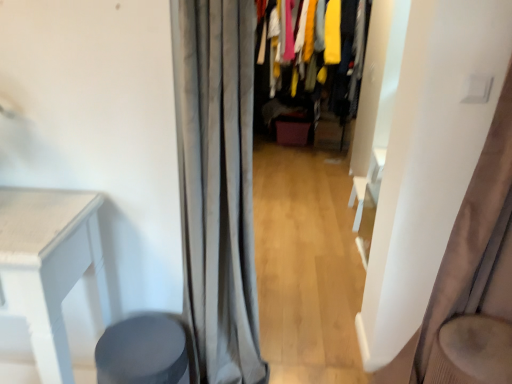
Where is `velvet fabric clothes at center`? The image size is (512, 384). velvet fabric clothes at center is located at coordinates (279, 82).

Measure the distance between satin beige curtain at right, positioned as the 1th curtain in right-to-left order, and camera.

satin beige curtain at right, positioned as the 1th curtain in right-to-left order, and camera are 4.15 feet apart from each other.

I want to click on matte gray stool at lower left, so click(x=143, y=351).

What are the coordinates of `gray fabric curtain at center, which is the first curtain from left to right` in the screenshot? It's located at (218, 190).

Locate an element on the screen. velvet fabric clothes at center is located at coordinates (279, 82).

From the image's perspective, which is below, matte gray stool at lower left or velvet beige swivel chair at right?

velvet beige swivel chair at right.

Considering the sizes of objects matte gray stool at lower left and velvet beige swivel chair at right in the image provided, who is thinner, matte gray stool at lower left or velvet beige swivel chair at right?

With smaller width is matte gray stool at lower left.

Which of these two, matte gray stool at lower left or velvet beige swivel chair at right, stands taller?

With more height is velvet beige swivel chair at right.

Is matte gray stool at lower left not within velvet beige swivel chair at right?

Indeed, matte gray stool at lower left is completely outside velvet beige swivel chair at right.

Based on the photo, how far apart are velvet fabric clothes at center and satin beige curtain at right, positioned as the 1th curtain in right-to-left order?

velvet fabric clothes at center is 2.83 meters away from satin beige curtain at right, positioned as the 1th curtain in right-to-left order.

Considering the sizes of objects velvet fabric clothes at center and satin beige curtain at right, arranged as the 2th curtain when viewed from the left, in the image provided, who is smaller, velvet fabric clothes at center or satin beige curtain at right, arranged as the 2th curtain when viewed from the left,?

Smaller between the two is satin beige curtain at right, arranged as the 2th curtain when viewed from the left.

Does point (255, 73) lie behind point (500, 366)?

Yes, point (255, 73) is farther from viewer.

Could satin beige curtain at right, arranged as the 2th curtain when viewed from the left, be considered to be inside velvet fabric clothes at center?

That's incorrect, satin beige curtain at right, arranged as the 2th curtain when viewed from the left, is not inside velvet fabric clothes at center.

Is matte gray stool at lower left taller than satin beige curtain at right, arranged as the 2th curtain when viewed from the left?

In fact, matte gray stool at lower left may be shorter than satin beige curtain at right, arranged as the 2th curtain when viewed from the left.

Based on the photo, is matte gray stool at lower left inside the boundaries of satin beige curtain at right, arranged as the 2th curtain when viewed from the left, or outside?

matte gray stool at lower left is located beyond the bounds of satin beige curtain at right, arranged as the 2th curtain when viewed from the left.

Considering the relative sizes of matte gray stool at lower left and satin beige curtain at right, arranged as the 2th curtain when viewed from the left, in the image provided, is matte gray stool at lower left thinner than satin beige curtain at right, arranged as the 2th curtain when viewed from the left,?

No.

Between matte gray stool at lower left and satin beige curtain at right, arranged as the 2th curtain when viewed from the left, which one has larger size?

satin beige curtain at right, arranged as the 2th curtain when viewed from the left.

Which object is closer to the camera, satin beige curtain at right, arranged as the 2th curtain when viewed from the left, or velvet beige swivel chair at right?

satin beige curtain at right, arranged as the 2th curtain when viewed from the left, is closer to the camera.

Is satin beige curtain at right, positioned as the 1th curtain in right-to-left order, turned away from velvet beige swivel chair at right?

Yes, velvet beige swivel chair at right is at the back of satin beige curtain at right, positioned as the 1th curtain in right-to-left order.

From the picture: Considering the relative sizes of satin beige curtain at right, arranged as the 2th curtain when viewed from the left, and velvet beige swivel chair at right in the image provided, is satin beige curtain at right, arranged as the 2th curtain when viewed from the left, smaller than velvet beige swivel chair at right?

No.

Locate an element on the screen. This screenshot has height=384, width=512. swivel chair that is on the right side of satin beige curtain at right, arranged as the 2th curtain when viewed from the left is located at coordinates (471, 351).

Based on the photo, from the image's perspective, between gray fabric curtain at center, which is the first curtain from left to right, and velvet beige swivel chair at right, which one is located above?

gray fabric curtain at center, which is the first curtain from left to right.

From the velvet beige swivel chair at right, count the 2nd curtain to the left and point to it. Please provide its 2D coordinates.

[(218, 190)]

From the picture: Could you tell me if gray fabric curtain at center, which is the first curtain from left to right, is turned towards velvet beige swivel chair at right?

No.

Considering the positions of objects gray fabric curtain at center, which is the first curtain from left to right, and velvet beige swivel chair at right in the image provided, who is more to the right, gray fabric curtain at center, which is the first curtain from left to right, or velvet beige swivel chair at right?

From the viewer's perspective, velvet beige swivel chair at right appears more on the right side.

How different are the orientations of velvet beige swivel chair at right and matte gray stool at lower left in degrees?

The facing directions of velvet beige swivel chair at right and matte gray stool at lower left are 9.99 degrees apart.

From the image's perspective, is velvet beige swivel chair at right above or below matte gray stool at lower left?

velvet beige swivel chair at right is below matte gray stool at lower left.

Is velvet beige swivel chair at right positioned beyond the bounds of matte gray stool at lower left?

Yes.

Based on the photo, is velvet fabric clothes at center placed right next to matte gray stool at lower left?

No, velvet fabric clothes at center is not beside matte gray stool at lower left.

How many degrees apart are the facing directions of velvet fabric clothes at center and matte gray stool at lower left?

The facing directions of velvet fabric clothes at center and matte gray stool at lower left are 0.368 degrees apart.

Find the location of a particular element. This screenshot has width=512, height=384. music stool located in front of the velvet fabric clothes at center is located at coordinates (143, 351).

Based on the photo, in the image, is velvet fabric clothes at center positioned in front of or behind matte gray stool at lower left?

In the image, velvet fabric clothes at center appears behind matte gray stool at lower left.

What are the coordinates of `swivel chair on the right side of matte gray stool at lower left` in the screenshot? It's located at (471, 351).

Find the location of a particular element. The image size is (512, 384). curtain that is the 2nd object located in front of the velvet fabric clothes at center is located at coordinates click(471, 279).

When comparing their distances from satin beige curtain at right, arranged as the 2th curtain when viewed from the left, does matte gray stool at lower left or velvet beige swivel chair at right seem closer?

velvet beige swivel chair at right lies closer to satin beige curtain at right, arranged as the 2th curtain when viewed from the left, than the other object.

Looking at the image, which one is located closer to matte gray stool at lower left, satin beige curtain at right, arranged as the 2th curtain when viewed from the left, or velvet fabric clothes at center?

The object closer to matte gray stool at lower left is satin beige curtain at right, arranged as the 2th curtain when viewed from the left.

Based on their spatial positions, is satin beige curtain at right, arranged as the 2th curtain when viewed from the left, or velvet beige swivel chair at right closer to velvet fabric clothes at center?

Among the two, satin beige curtain at right, arranged as the 2th curtain when viewed from the left, is located nearer to velvet fabric clothes at center.

Estimate the real-world distances between objects in this image. Which object is closer to velvet fabric clothes at center, matte gray stool at lower left or gray fabric curtain at center, which is the first curtain from left to right?

gray fabric curtain at center, which is the first curtain from left to right, lies closer to velvet fabric clothes at center than the other object.

Looking at the image, which one is located closer to velvet beige swivel chair at right, gray fabric curtain at center, which is the 2th curtain in right-to-left order, or matte gray stool at lower left?

gray fabric curtain at center, which is the 2th curtain in right-to-left order, lies closer to velvet beige swivel chair at right than the other object.

Based on their spatial positions, is velvet fabric clothes at center or satin beige curtain at right, arranged as the 2th curtain when viewed from the left, further from gray fabric curtain at center, which is the first curtain from left to right?

velvet fabric clothes at center is further to gray fabric curtain at center, which is the first curtain from left to right.

Based on their spatial positions, is satin beige curtain at right, arranged as the 2th curtain when viewed from the left, or matte gray stool at lower left closer to gray fabric curtain at center, which is the 2th curtain in right-to-left order?

matte gray stool at lower left.

Considering their positions, is velvet fabric clothes at center positioned further to matte gray stool at lower left than gray fabric curtain at center, which is the first curtain from left to right?

velvet fabric clothes at center lies further to matte gray stool at lower left than the other object.

Where is `curtain situated between gray fabric curtain at center, which is the first curtain from left to right, and velvet beige swivel chair at right from left to right`? This screenshot has width=512, height=384. curtain situated between gray fabric curtain at center, which is the first curtain from left to right, and velvet beige swivel chair at right from left to right is located at coordinates (471, 279).

At what (x,y) coordinates should I click in order to perform the action: click on music stool between velvet beige swivel chair at right and velvet fabric clothes at center along the z-axis. Please return your answer as a coordinate pair (x, y). The image size is (512, 384). Looking at the image, I should click on (143, 351).

You are a GUI agent. You are given a task and a screenshot of the screen. Output one action in this format:
    pyautogui.click(x=<x>, y=<y>)
    Task: Click on the swivel chair between gray fabric curtain at center, which is the 2th curtain in right-to-left order, and velvet fabric clothes at center from front to back
    The image size is (512, 384).
    Given the screenshot: What is the action you would take?
    pyautogui.click(x=471, y=351)

In order to click on music stool between gray fabric curtain at center, which is the 2th curtain in right-to-left order, and velvet fabric clothes at center in the front-back direction in this screenshot , I will do `click(143, 351)`.